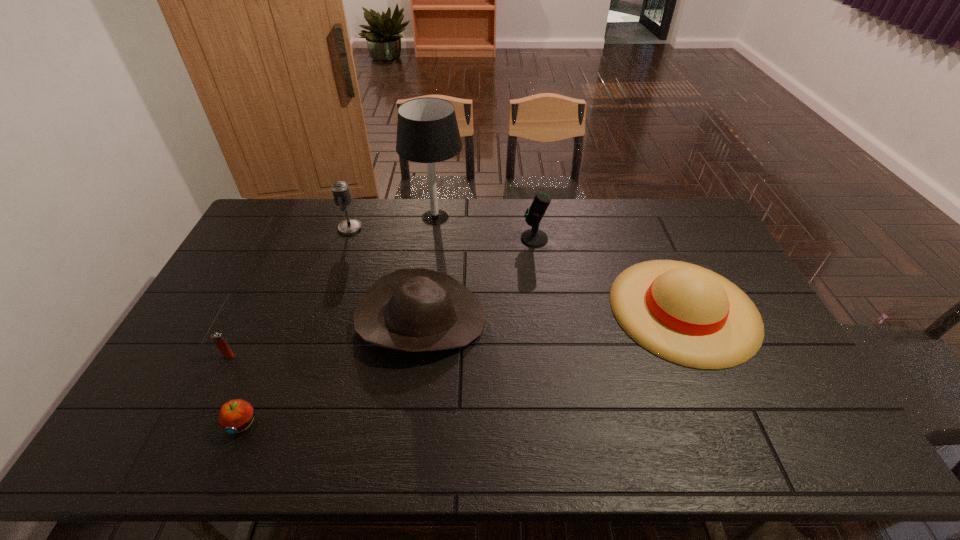
Where is `blank area located 0.370m on the right of the right microphone`? This screenshot has height=540, width=960. blank area located 0.370m on the right of the right microphone is located at coordinates (652, 239).

This screenshot has width=960, height=540. In order to click on vacant region located 0.360m on the back of the cowboy hat in this screenshot , I will do [434, 215].

Where is `vacant region located on the left of the rightmost object`? Image resolution: width=960 pixels, height=540 pixels. vacant region located on the left of the rightmost object is located at coordinates (498, 309).

The width and height of the screenshot is (960, 540). Find the location of `blank space located 0.130m on the right of the leftmost object`. blank space located 0.130m on the right of the leftmost object is located at coordinates (282, 356).

Identify the location of free space located on the back of the apple. This screenshot has width=960, height=540. (274, 345).

This screenshot has height=540, width=960. What are the coordinates of `table lamp that is at the far edge` in the screenshot? It's located at (427, 131).

The width and height of the screenshot is (960, 540). What are the coordinates of `object at the near edge` in the screenshot? It's located at (234, 416).

Image resolution: width=960 pixels, height=540 pixels. In order to click on object positioned at the left edge in this screenshot , I will do `click(217, 338)`.

I want to click on object at the right edge, so click(686, 314).

I want to click on free space at the far edge of the desktop, so click(391, 212).